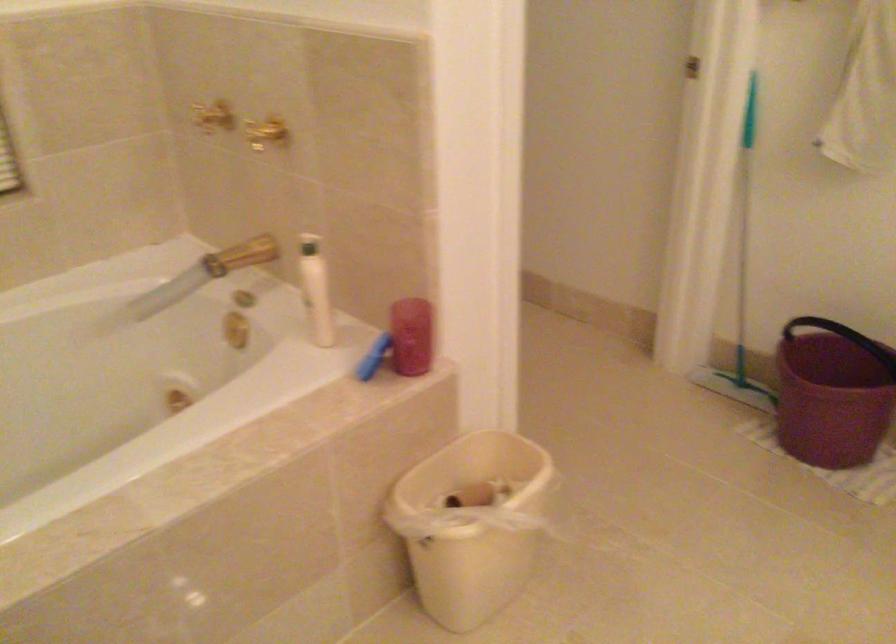
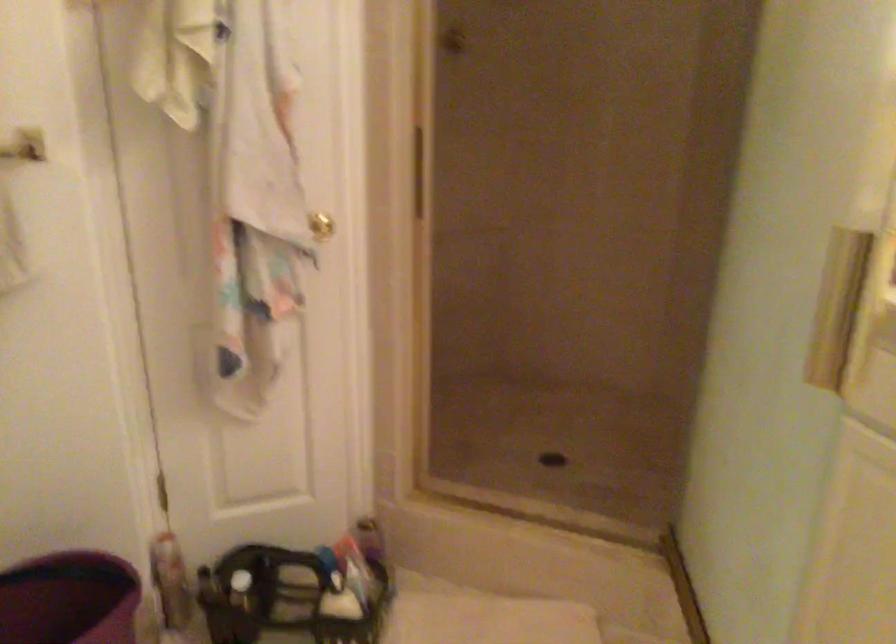
Question: The camera is either moving clockwise (left) or counter-clockwise (right) around the object. The first image is from the beginning of the video and the second image is from the end. Is the camera moving left or right when shooting the video?

Choices:
 (A) Left
 (B) Right

Answer: (A)